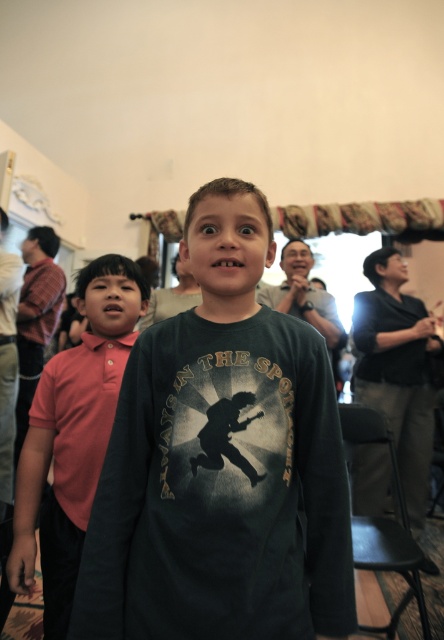
You are organizing a clothing display and need to arrange the pink cotton polo shirt at left and the red cotton polo shirt at left based on their heights. Which one should you place higher up on the rack?

The pink cotton polo shirt at left is much taller than the red cotton polo shirt at left, so you should place the pink cotton polo shirt at left higher up on the rack.